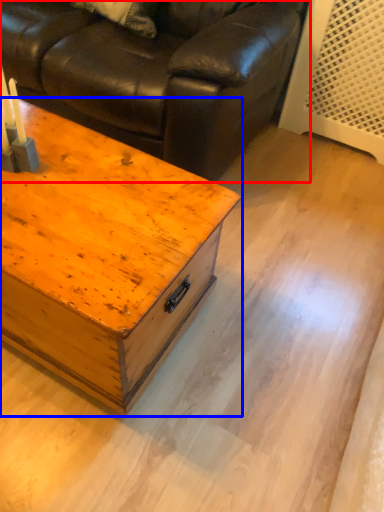
Question: Which object appears farthest to the camera in this image, studio couch (highlighted by a red box) or table (highlighted by a blue box)?

Choices:
 (A) studio couch
 (B) table

Answer: (A)